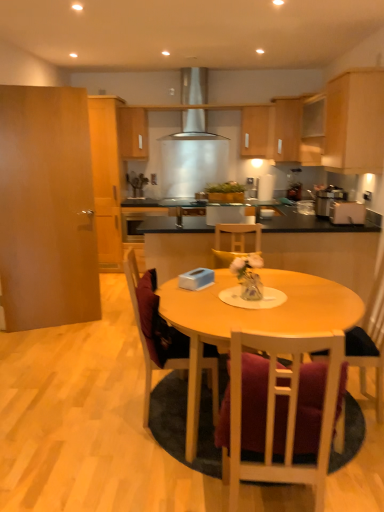
Identify the location of free space that is to the left of light wood table at center. This screenshot has height=512, width=384. (72, 426).